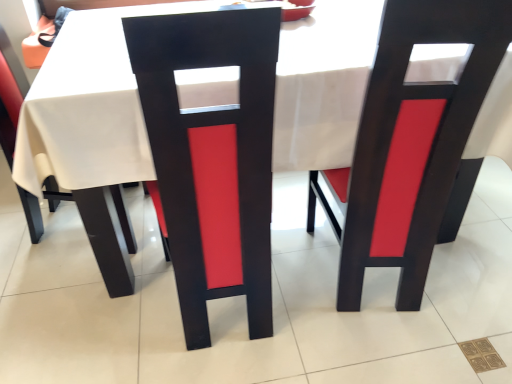
I want to click on free space in front of matte black chair at left, placed as the 1th chair when sorted from left to right, so click(71, 292).